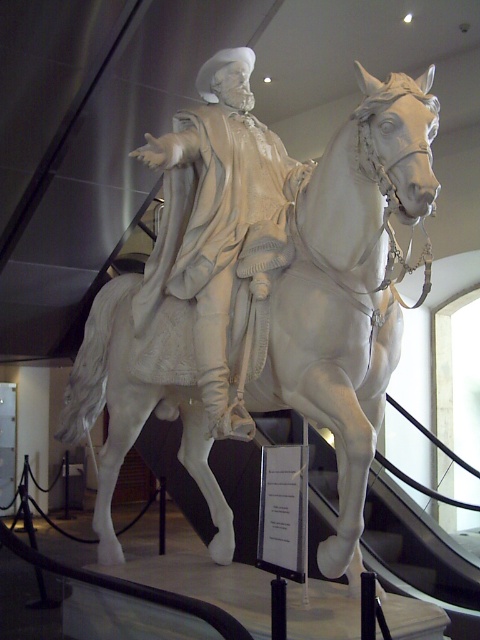
Question: Does white marble horse at center appear under white marble statue at center?

Choices:
 (A) no
 (B) yes

Answer: (B)

Question: Which point is farther to the camera?

Choices:
 (A) (163, 166)
 (B) (292, 330)

Answer: (A)

Question: Which point is farther to the camera?

Choices:
 (A) white marble horse at center
 (B) white marble statue at center

Answer: (B)

Question: Which point is closer to the camera?

Choices:
 (A) white marble horse at center
 (B) white marble statue at center

Answer: (A)

Question: Is white marble horse at center wider than white marble statue at center?

Choices:
 (A) yes
 (B) no

Answer: (A)

Question: Does white marble horse at center have a larger size compared to white marble statue at center?

Choices:
 (A) no
 (B) yes

Answer: (B)